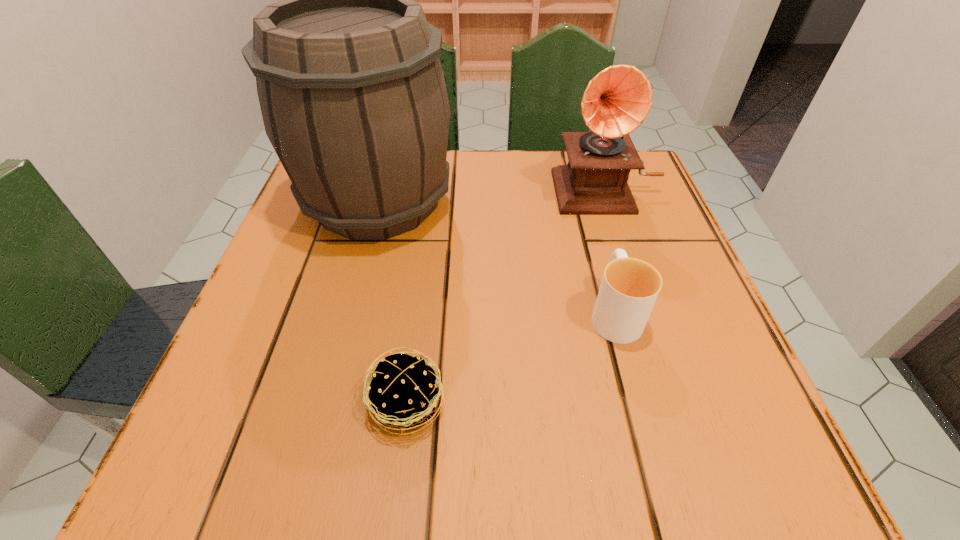
You are a GUI agent. You are given a task and a screenshot of the screen. Output one action in this format:
    pyautogui.click(x=<x>, y=<y>)
    Task: Click on the vacant space that is in between the phonograph record and the shortest object
    The image size is (960, 540).
    Given the screenshot: What is the action you would take?
    pyautogui.click(x=506, y=296)

Find the location of `free space between the nearest object and the wine bucket`. free space between the nearest object and the wine bucket is located at coordinates (393, 303).

Where is `vacant area between the patty and the third shortest object`? Image resolution: width=960 pixels, height=540 pixels. vacant area between the patty and the third shortest object is located at coordinates pyautogui.click(x=506, y=296).

What are the coordinates of `empty space between the patty and the cup` in the screenshot? It's located at (511, 358).

At what (x,y) coordinates should I click in order to perform the action: click on unoccupied area between the wine bucket and the second nearest object. Please return your answer as a coordinate pair (x, y). Looking at the image, I should click on (496, 256).

Identify the location of free space between the wine bucket and the phonograph record. Image resolution: width=960 pixels, height=540 pixels. [492, 194].

Identify the location of object that ranks as the closest to the wine bucket. (617, 100).

The height and width of the screenshot is (540, 960). In order to click on object that is the closest to the patty in this screenshot , I will do `click(629, 288)`.